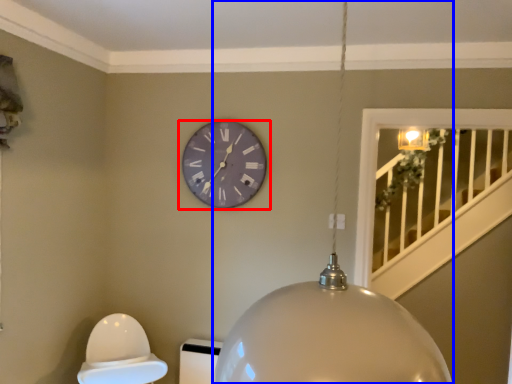
Question: Which point is further to the camera, wall clock (highlighted by a red box) or lamp (highlighted by a blue box)?

Choices:
 (A) wall clock
 (B) lamp

Answer: (A)